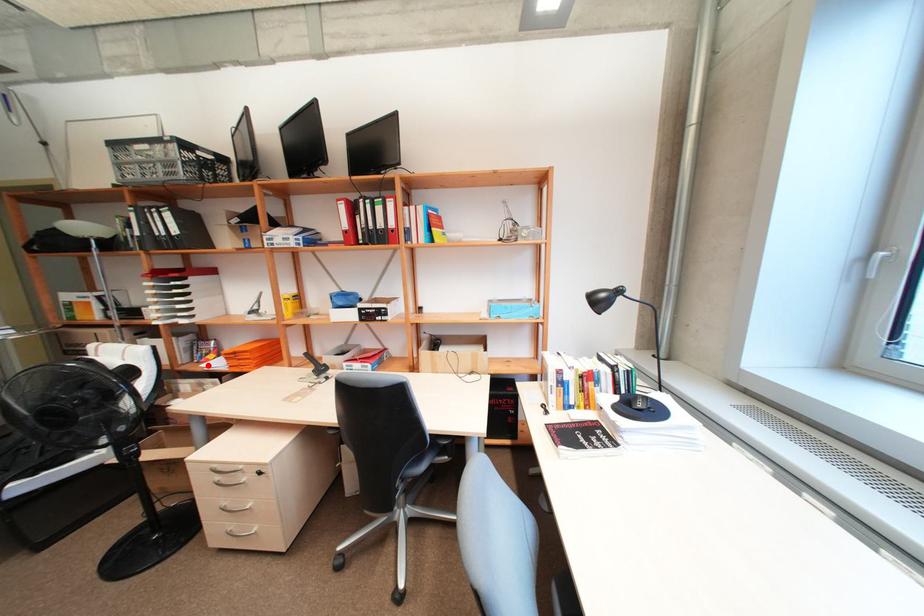
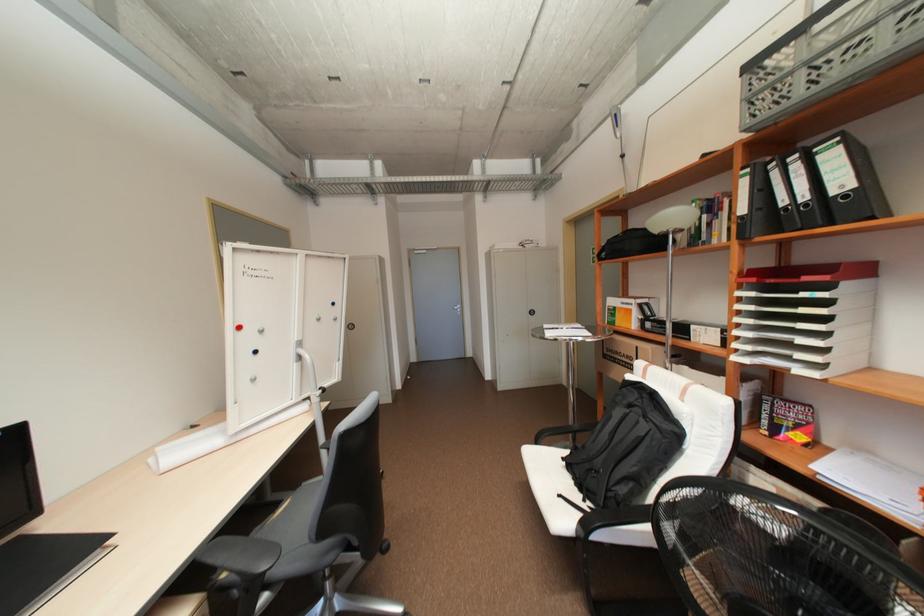
Find the pixel in the second image that matches the highlighted location in the first image.

(820, 467)